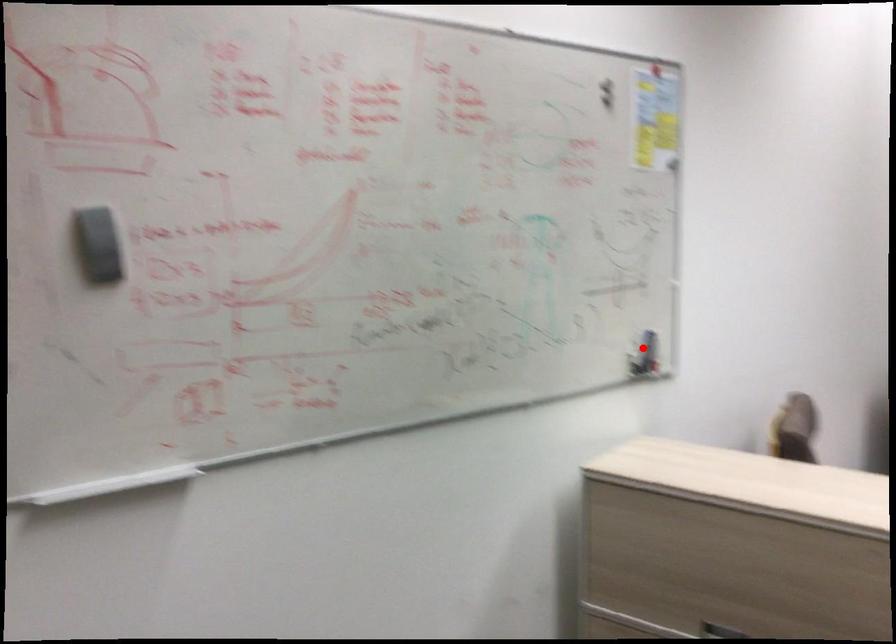
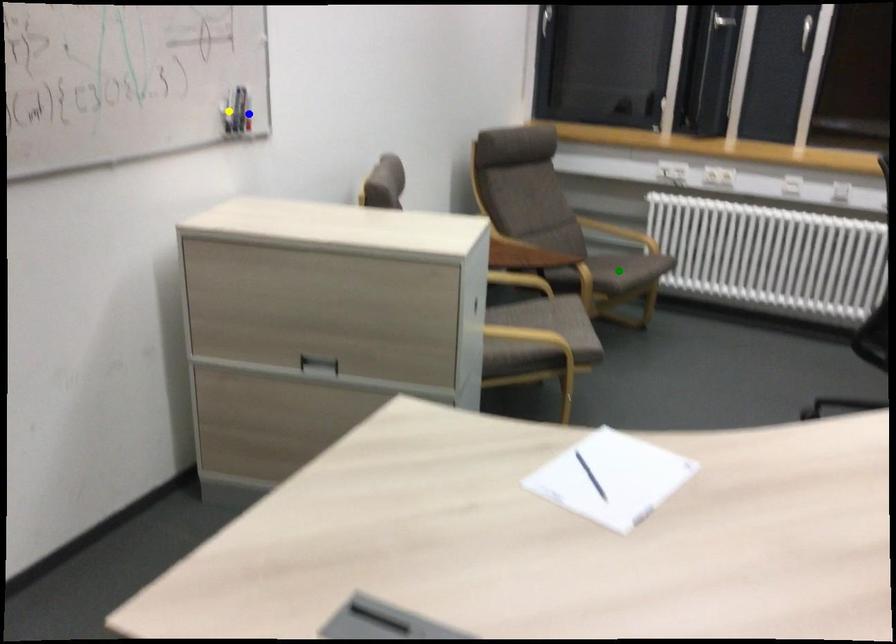
Question: I am providing you with two images of the same scene from different viewpoints. A red point is marked on the first image. You are given multiple points on the second image. In image 2, which mark is for the same physical point as the one in image 1?

Choices:
 (A) yellow point
 (B) green point
 (C) blue point

Answer: (A)